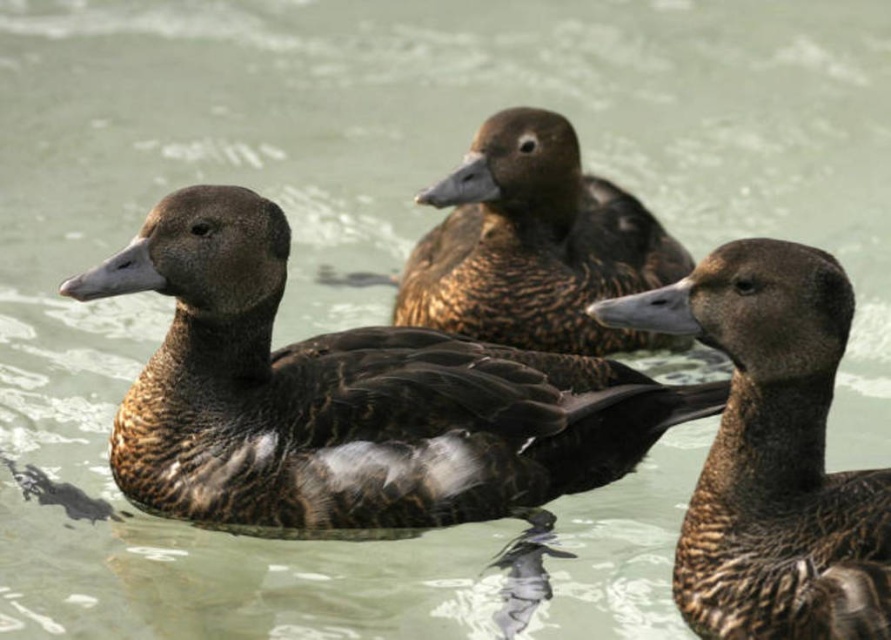
You are standing at the edge of the water and see a point marked at coordinates (772, 452). Which object is located at that point?

The point at coordinates (772, 452) corresponds to the brown speckled duck at center.

You are standing at the edge of the water and see a point marked at coordinates (348, 397). Which object is located at that point?

The point at coordinates (348, 397) indicates the brown matte duck at center.

You are observing the ducks in the water. Which object is nearer to you between the brown matte duck at center and the brown speckled feathers at center?

The brown matte duck at center is closer to the viewer than the brown speckled feathers at center.